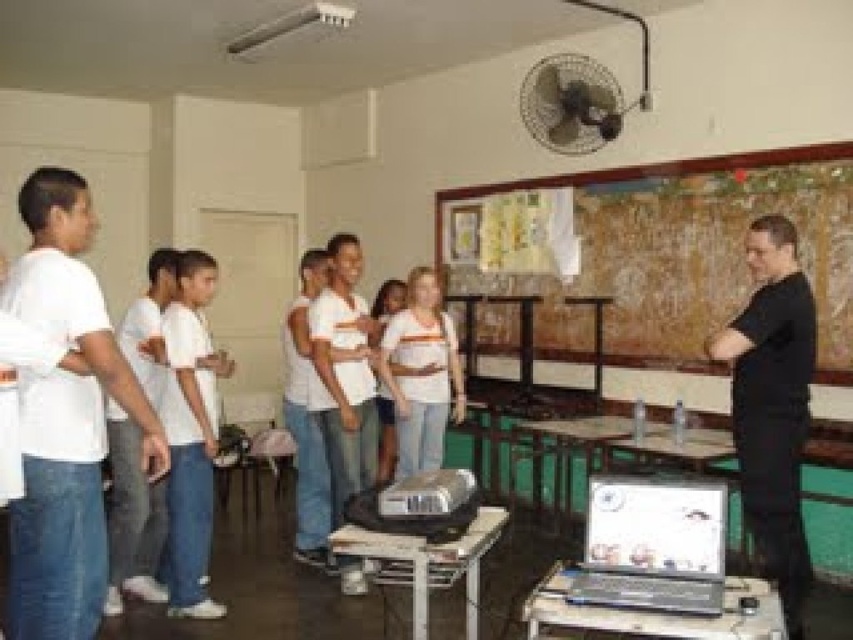
Is white cotton shirt at left taller than metallic silver fan at upper center?

Yes, white cotton shirt at left is taller than metallic silver fan at upper center.

Between white cotton shirt at left and metallic silver fan at upper center, which one has more height?

white cotton shirt at left is taller.

Locate an element on the screen. Image resolution: width=853 pixels, height=640 pixels. white cotton shirt at left is located at coordinates (65, 419).

Who is shorter, white cotton shirt at left or black matte shirt at right?

With less height is white cotton shirt at left.

Consider the image. Who is higher up, white cotton shirt at left or black matte shirt at right?

white cotton shirt at left is above.

The height and width of the screenshot is (640, 853). What are the coordinates of `white cotton shirt at left` in the screenshot? It's located at (65, 419).

Is white matte shirt at center above metallic silver fan at upper center?

No.

Can you confirm if white matte shirt at center is positioned to the left of metallic silver fan at upper center?

Yes, white matte shirt at center is to the left of metallic silver fan at upper center.

Image resolution: width=853 pixels, height=640 pixels. In order to click on white matte shirt at center in this screenshot , I will do [190, 435].

Identify the location of white matte shirt at center. (190, 435).